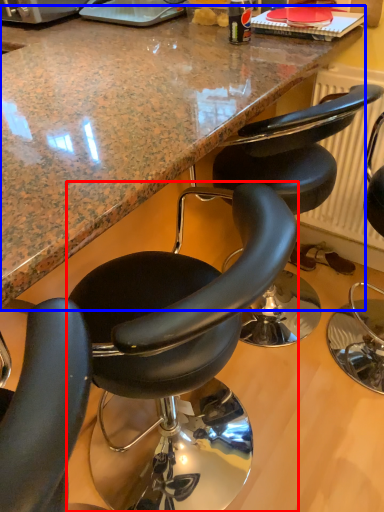
Question: Which object appears closest to the camera in this image, chair (highlighted by a red box) or countertop (highlighted by a blue box)?

Choices:
 (A) chair
 (B) countertop

Answer: (B)